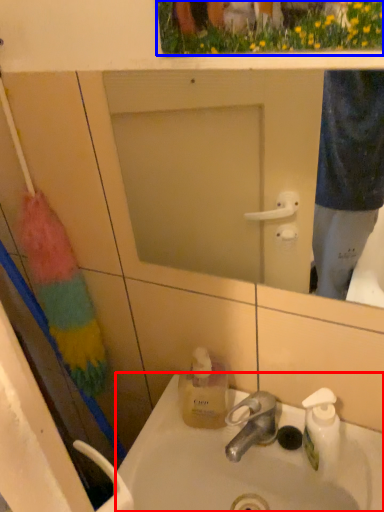
Question: Which of the following is the farthest to the observer, sink (highlighted by a red box) or flower (highlighted by a blue box)?

Choices:
 (A) sink
 (B) flower

Answer: (A)